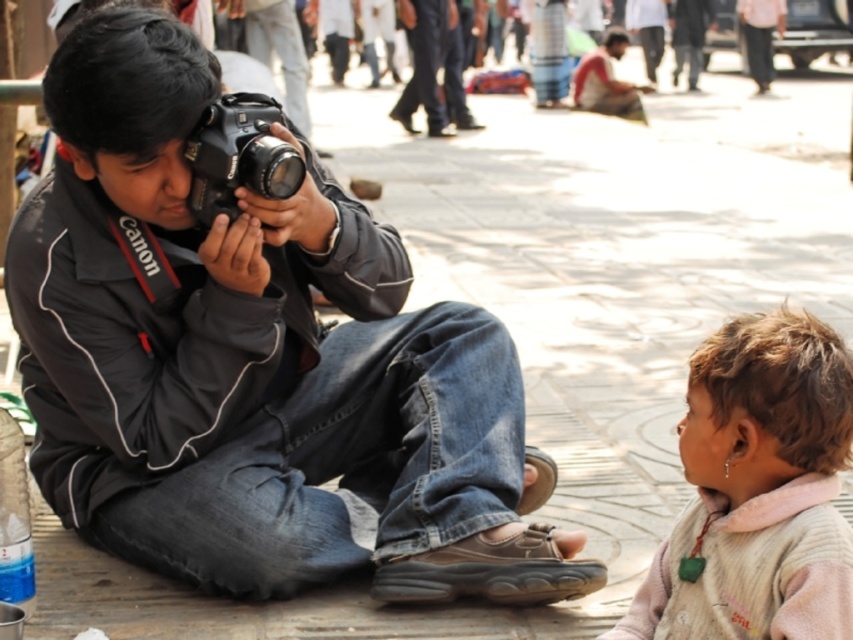
You are a photographer who needs to capture a wide shot of both the black matte camera at center and the dark blue jeans at center in the scene. Given the distance between them, what is the minimum focal length lens you should use if your camera sensor has a 35mm equivalent field of view?

The minimum focal length lens required would be approximately 35mm divided by the distance between the two objects. However, since the distance is 45.84 feet, a standard 35mm lens should suffice to capture both the black matte camera at center and the dark blue jeans at center in the frame.

You are a photographer trying to capture the scene. The man with the camera is in the foreground, and you notice the light brown hair at lower right and dark blue jeans at center. Which object is positioned lower in the image?

The light brown hair at lower right is positioned below the dark blue jeans at center in the image.

You are standing at point A, which is at coordinates point(448,44). You want to walk towards the photographer in the scene. Is the point(363,358) between you and the photographer?

Yes, the point(363,358) is between you and the photographer because it is in front of point(448,44), which is your current position.